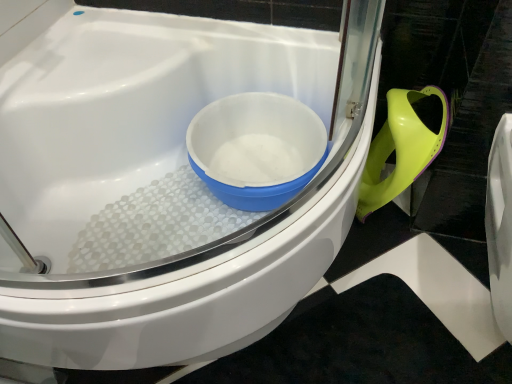
Question: Is there a large distance between white plastic bowl at center and white glossy toilet at center?

Choices:
 (A) no
 (B) yes

Answer: (A)

Question: Is white plastic bowl at center taller than white glossy toilet at center?

Choices:
 (A) yes
 (B) no

Answer: (B)

Question: Is white glossy toilet at center surrounded by white plastic bowl at center?

Choices:
 (A) no
 (B) yes

Answer: (A)

Question: Is the position of white plastic bowl at center more distant than that of white glossy toilet at center?

Choices:
 (A) yes
 (B) no

Answer: (A)

Question: Can you confirm if white plastic bowl at center is positioned to the left of white glossy toilet at center?

Choices:
 (A) yes
 (B) no

Answer: (B)

Question: Does white plastic bowl at center have a larger size compared to white glossy toilet at center?

Choices:
 (A) no
 (B) yes

Answer: (A)

Question: Is white glossy toilet at center in contact with white plastic bowl at center?

Choices:
 (A) no
 (B) yes

Answer: (A)

Question: From a real-world perspective, is white glossy toilet at center physically below white plastic bowl at center?

Choices:
 (A) yes
 (B) no

Answer: (A)

Question: From the image's perspective, is white glossy toilet at center beneath white plastic bowl at center?

Choices:
 (A) yes
 (B) no

Answer: (A)

Question: Does white glossy toilet at center appear on the right side of white plastic bowl at center?

Choices:
 (A) no
 (B) yes

Answer: (A)

Question: Is white glossy toilet at center facing away from white plastic bowl at center?

Choices:
 (A) yes
 (B) no

Answer: (A)

Question: Considering the relative sizes of white glossy toilet at center and white plastic bowl at center in the image provided, is white glossy toilet at center thinner than white plastic bowl at center?

Choices:
 (A) no
 (B) yes

Answer: (A)

Question: Considering their positions, is white glossy toilet at center located in front of or behind white plastic bowl at center?

Choices:
 (A) behind
 (B) front

Answer: (B)